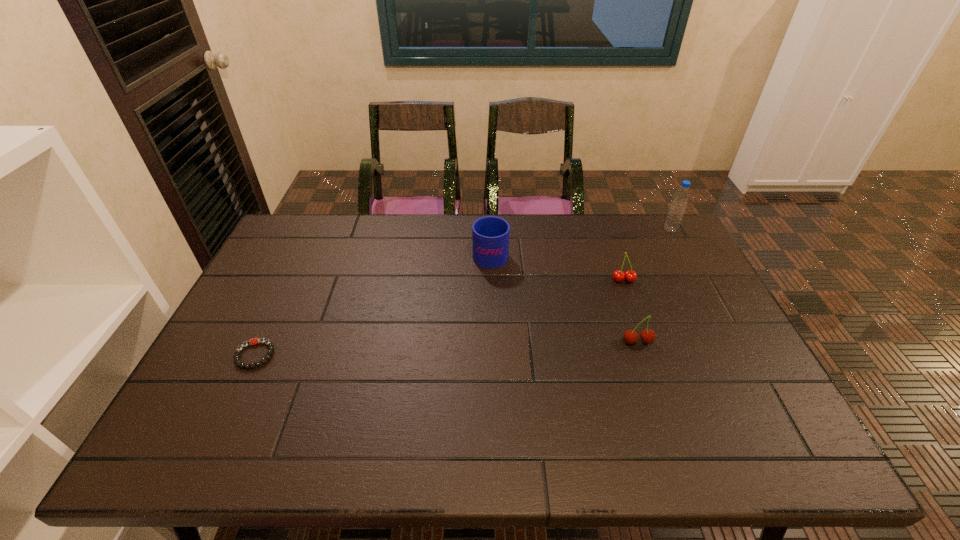
Image resolution: width=960 pixels, height=540 pixels. Identify the location of the tallest object. (678, 205).

This screenshot has width=960, height=540. Identify the location of water bottle. (678, 205).

Find the location of a particular element. The width and height of the screenshot is (960, 540). the fourth shortest object is located at coordinates (490, 235).

Where is `mug`? Image resolution: width=960 pixels, height=540 pixels. mug is located at coordinates (490, 235).

Where is `the nearer cherry`? The image size is (960, 540). the nearer cherry is located at coordinates (630, 336).

I want to click on the third farthest object, so click(x=630, y=275).

At what (x,y) coordinates should I click in order to perform the action: click on the leftmost object. Please return your answer as a coordinate pair (x, y). The image size is (960, 540). Looking at the image, I should click on (253, 341).

Image resolution: width=960 pixels, height=540 pixels. I want to click on the shortest object, so click(x=253, y=341).

Find the location of a particular element. Image resolution: width=960 pixels, height=540 pixels. free point located 0.130m on the left of the farthest object is located at coordinates (627, 230).

The image size is (960, 540). I want to click on free space located 0.080m on the side with the handle of the fourth object from right to left, so click(x=490, y=225).